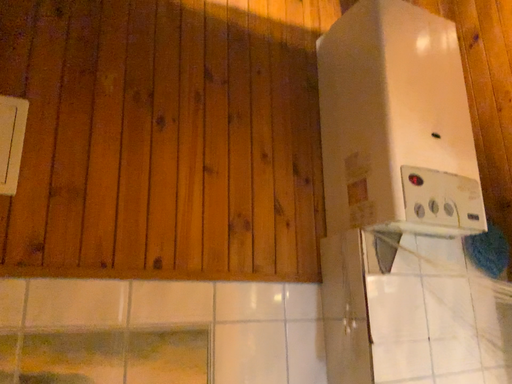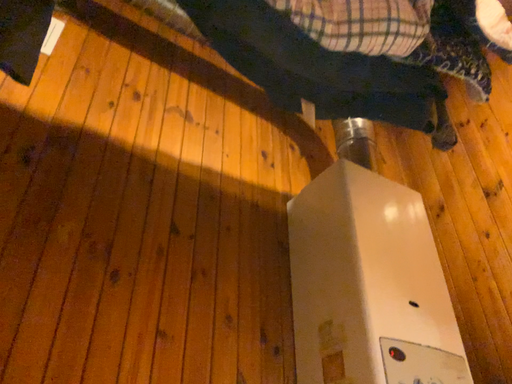
Question: Which way did the camera rotate in the video?

Choices:
 (A) rotated upward
 (B) rotated downward

Answer: (A)